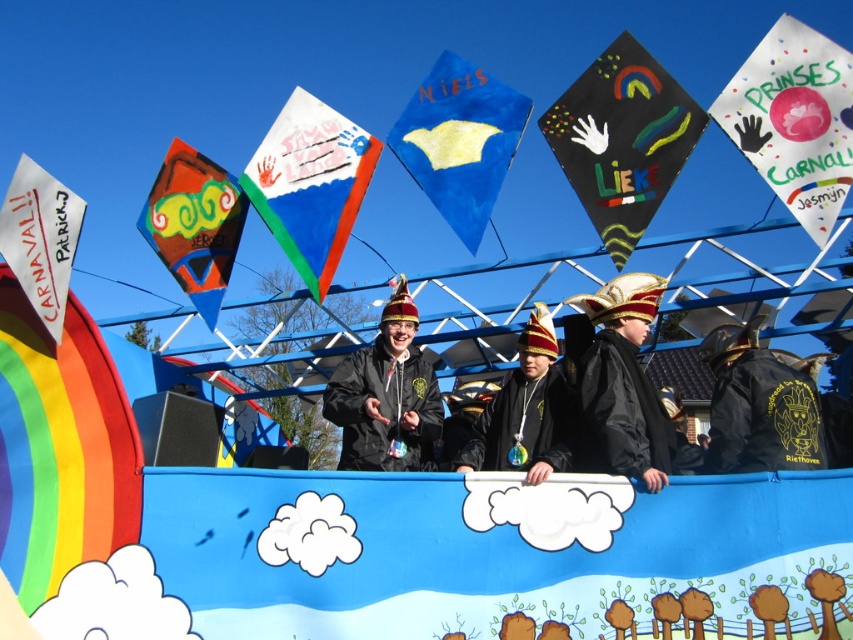
Measure the distance between point (798, 131) and camera.

A distance of 28.04 meters exists between point (798, 131) and camera.

Can you confirm if white paper flag at upper right is shorter than matte blue kite at center?

Yes, white paper flag at upper right is shorter than matte blue kite at center.

Does point (840, 116) lie behind point (312, 112)?

No.

Locate an element on the screen. Image resolution: width=853 pixels, height=640 pixels. white paper flag at upper right is located at coordinates (793, 120).

Is the position of black velvet hat at center more distant than that of white paper flag at left?

No, black velvet hat at center is closer to the viewer.

Is black velvet hat at center positioned before white paper flag at left?

Yes, it is.

Is point (640, 337) closer to camera compared to point (36, 282)?

Yes, it is.

Identify the location of black velvet hat at center. The image size is (853, 640). (622, 384).

Measure the distance between point (750, 138) and camera.

Point (750, 138) and camera are 92.68 feet apart from each other.

Who is higher up, white paper flag at upper right or black velvet hat at center?

Positioned higher is white paper flag at upper right.

Is point (842, 156) more distant than point (653, 307)?

That is True.

The height and width of the screenshot is (640, 853). In order to click on white paper flag at upper right in this screenshot , I will do `click(793, 120)`.